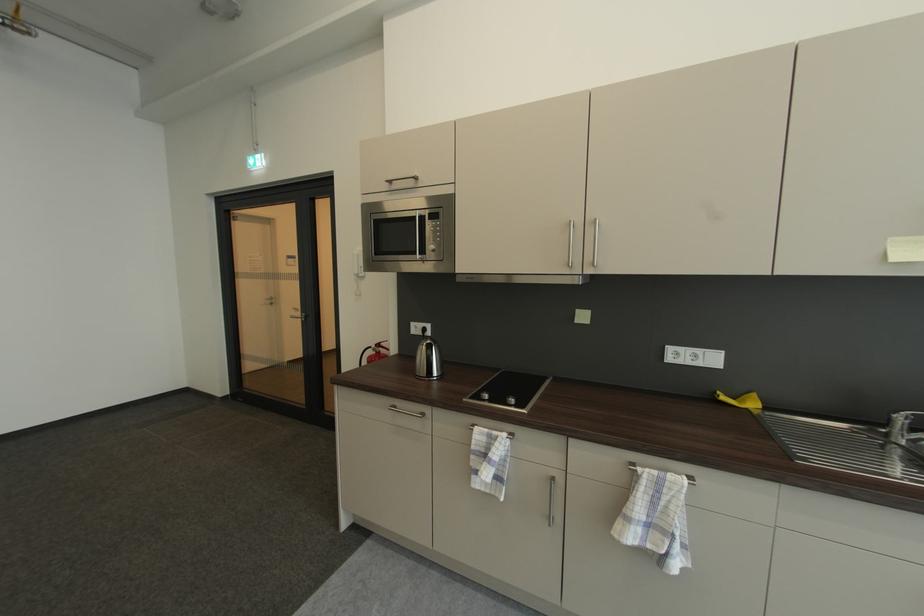
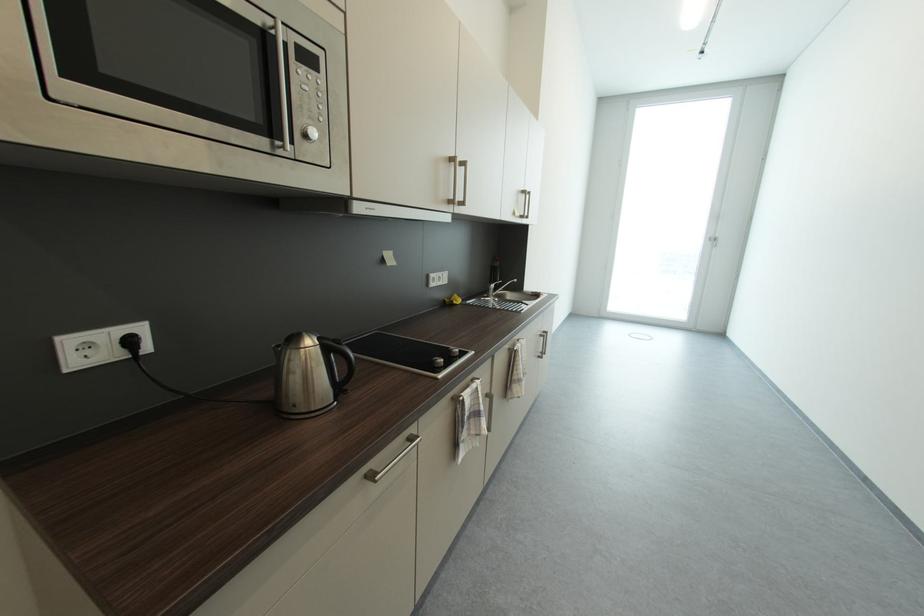
In the second image, find the point that corresponds to (431,331) in the first image.

(137, 344)